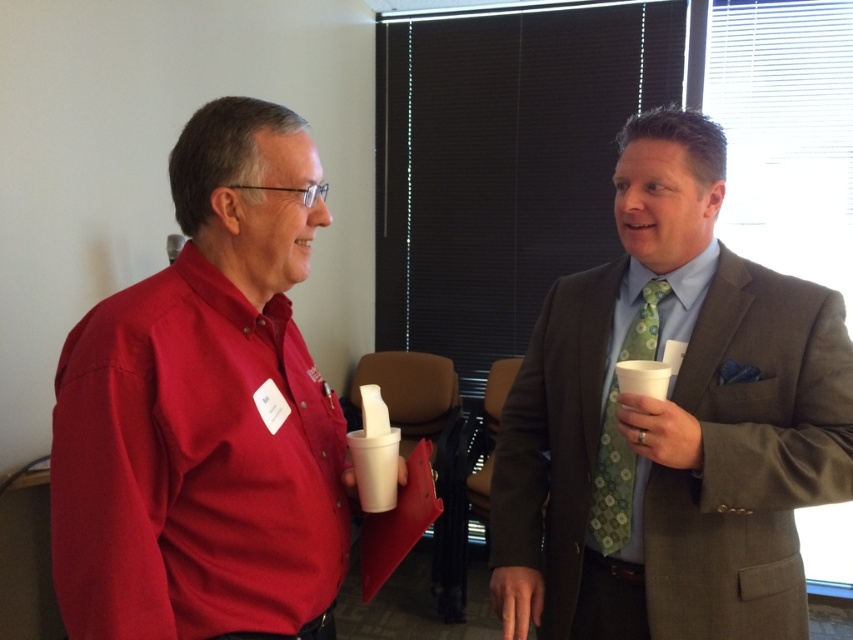
You are a photographer positioned behind the two people in the scene. You want to take a photo of the green floral tie at right without including the matte red shirt at left in the frame. Is this possible based on their current positions?

The matte red shirt at left is in front of the green floral tie at right, so it would block the view of the green floral tie at right. Therefore, it is not possible to take a photo of the green floral tie at right without including the matte red shirt at left in the frame.